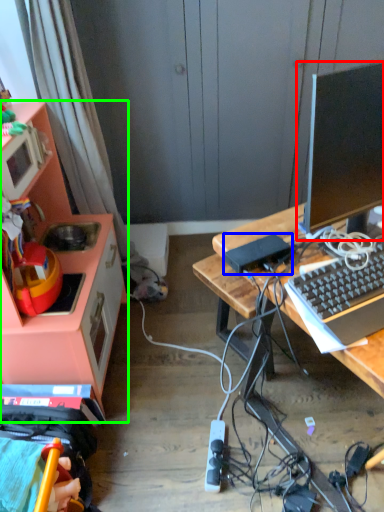
Question: Based on their relative distances, which object is nearer to television (highlighted by a red box)? Choose from appliance (highlighted by a blue box) and cabinetry (highlighted by a green box).

Choices:
 (A) appliance
 (B) cabinetry

Answer: (A)